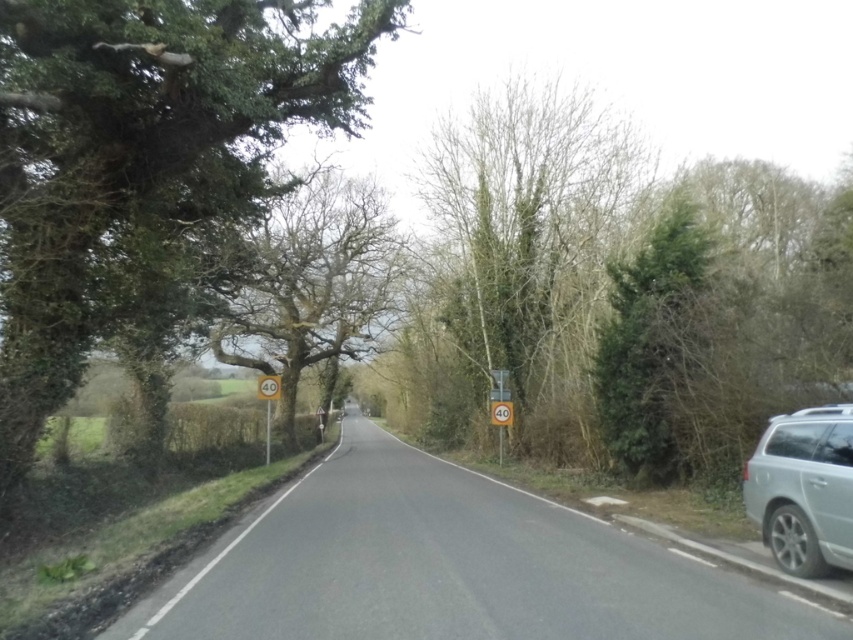
You are standing on the rural road and want to take a photo of the green leafy tree at left. Where should you position yourself to capture it in your camera frame?

The green leafy tree at left is located at coordinates point (x=138, y=148), so you should position yourself facing that coordinate to capture it in your camera frame.

You are a pedestrian standing on the side of the road and want to cross to the other side. You see the silver metallic minivan at right and the yellow plastic speed limit sign at left. Which object is higher up in the image?

The silver metallic minivan at right is located above the yellow plastic speed limit sign at left, so the silver metallic minivan at right is higher up in the image.